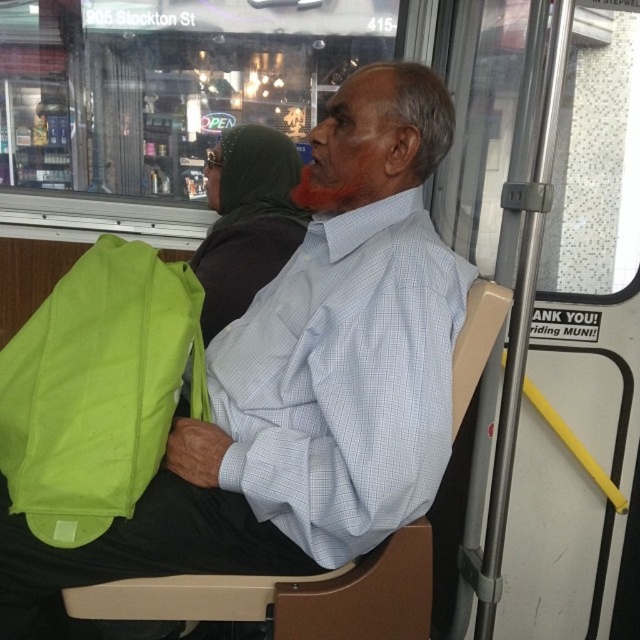
Measure the distance between green fabric bag at left and camera.

3.32 feet

At what (x,y) coordinates should I click in order to perform the action: click on green fabric bag at left. Please return your answer as a coordinate pair (x, y). Looking at the image, I should click on (97, 388).